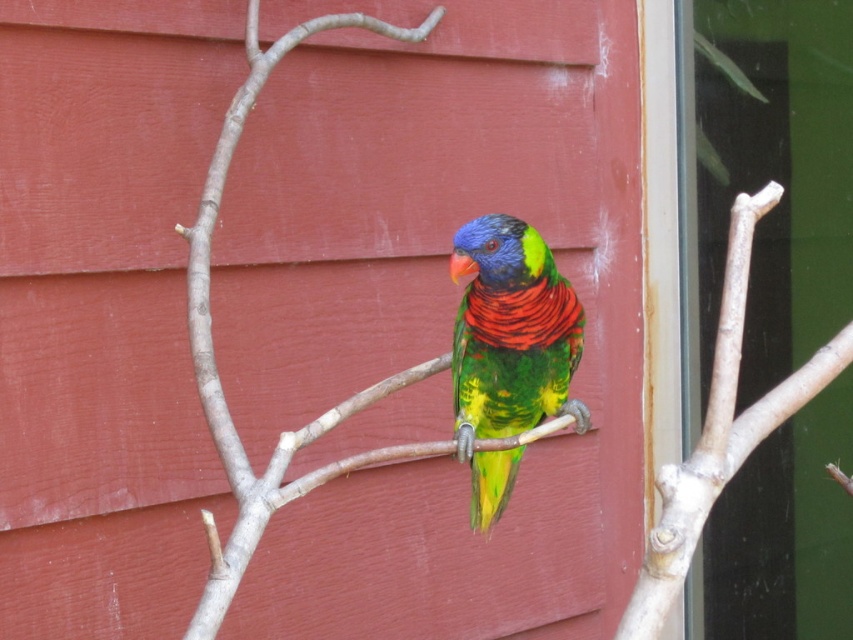
Is transparent glass at center thinner than multicolored feathered parrot at center?

No, transparent glass at center is not thinner than multicolored feathered parrot at center.

Which is above, transparent glass at center or multicolored feathered parrot at center?

transparent glass at center is higher up.

Identify the location of transparent glass at center. The height and width of the screenshot is (640, 853). (776, 177).

This screenshot has width=853, height=640. Find the location of `transparent glass at center`. transparent glass at center is located at coordinates (776, 177).

Which is below, transparent glass at center or smooth wood branch at center?

Positioned lower is transparent glass at center.

Is point (764, 316) closer to camera compared to point (322, 19)?

No, (764, 316) is behind (322, 19).

What are the coordinates of `transparent glass at center` in the screenshot? It's located at (776, 177).

Is multicolored feathered parrot at center behind smooth wood branch at center?

Yes, it is behind smooth wood branch at center.

Who is more forward, (x=532, y=310) or (x=218, y=556)?

Point (x=218, y=556) is more forward.

This screenshot has width=853, height=640. What do you see at coordinates (508, 349) in the screenshot?
I see `multicolored feathered parrot at center` at bounding box center [508, 349].

Locate an element on the screen. Image resolution: width=853 pixels, height=640 pixels. multicolored feathered parrot at center is located at coordinates (508, 349).